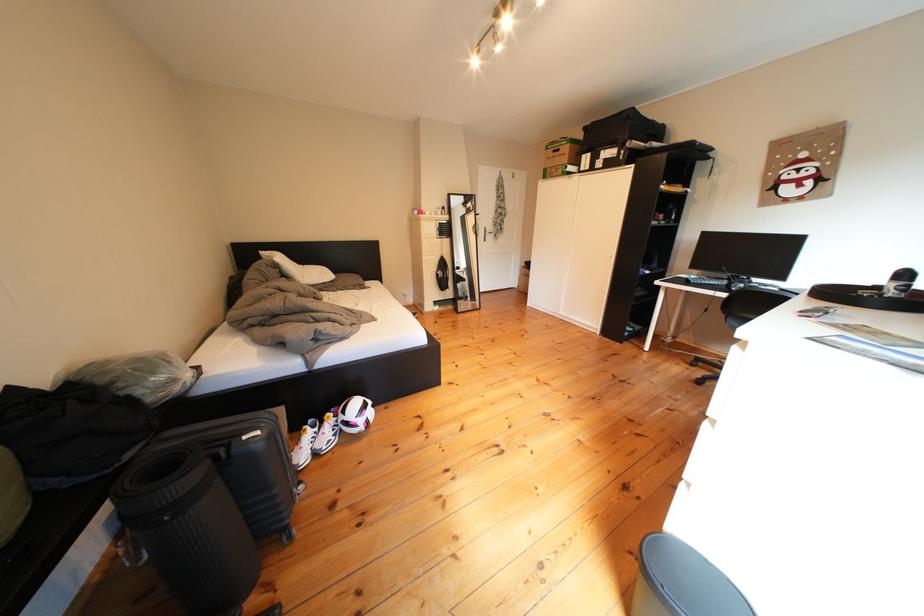
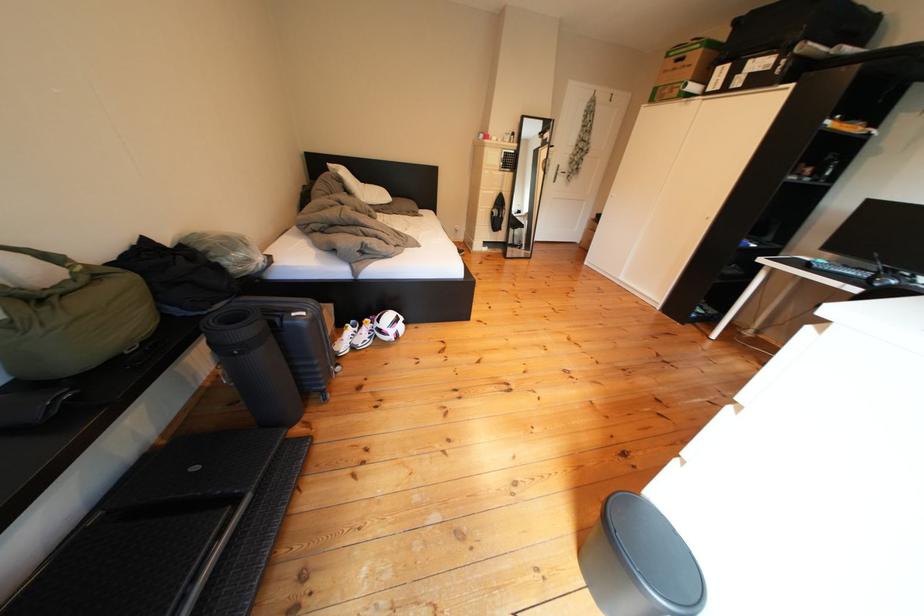
Locate, in the second image, the point that corresponds to pixel 343 419 in the first image.

(381, 325)